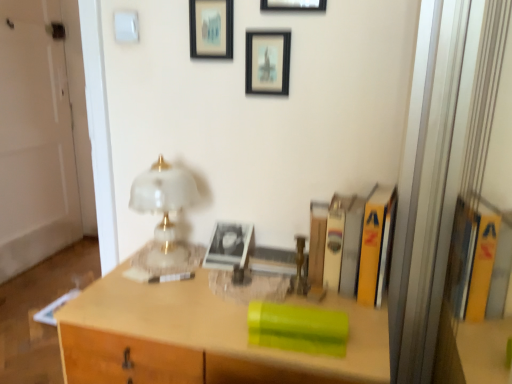
Identify the location of vacant area on top of green plastic container at center (from a real-world perspective). This screenshot has height=384, width=512. (214, 291).